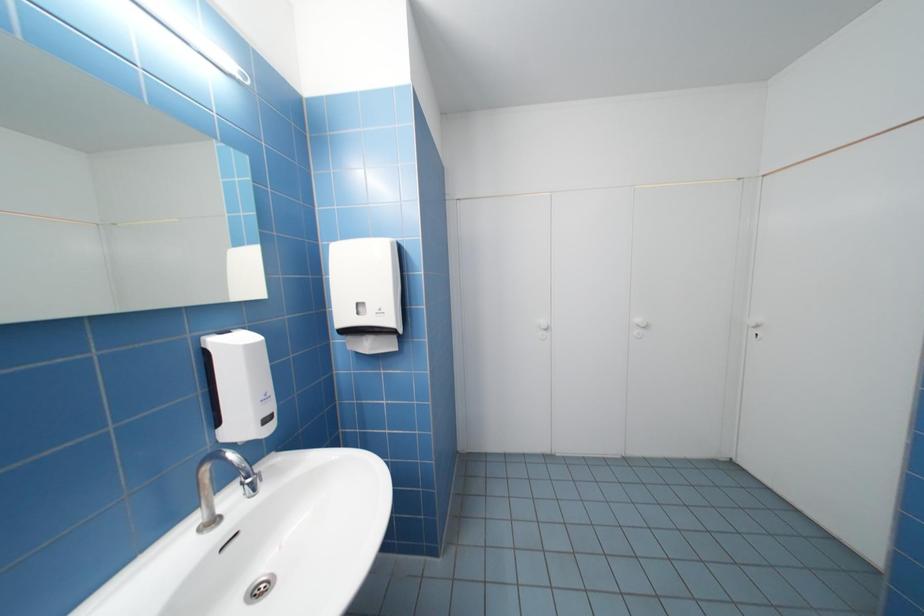
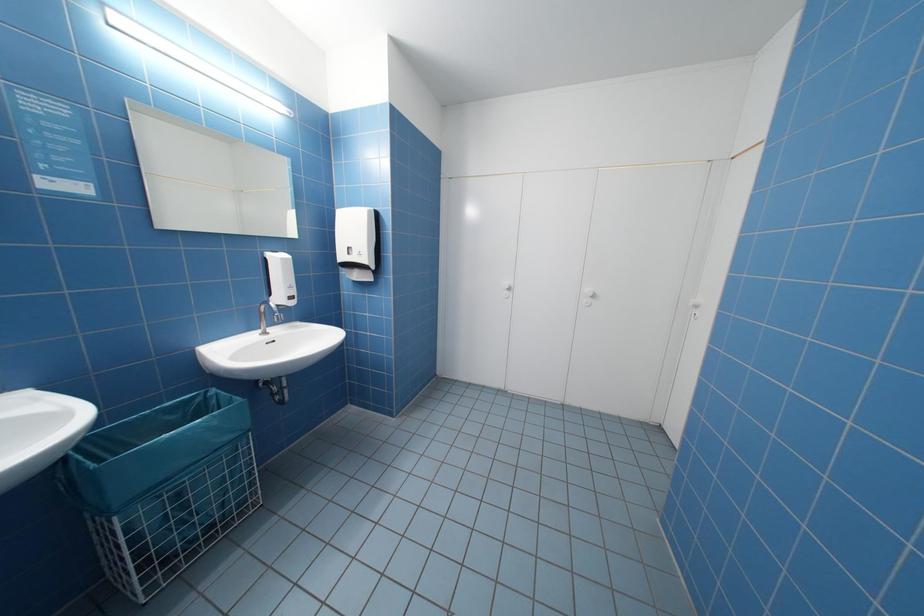
Question: The images are taken continuously from a first-person perspective. In which direction is your viewpoint rotating?

Choices:
 (A) Left
 (B) Right
 (C) Up
 (D) Down

Answer: (A)